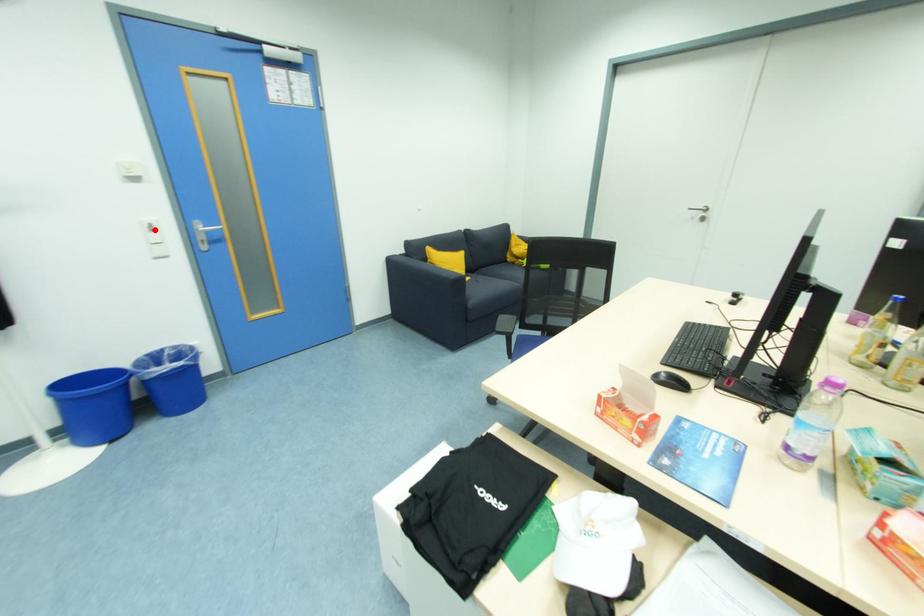
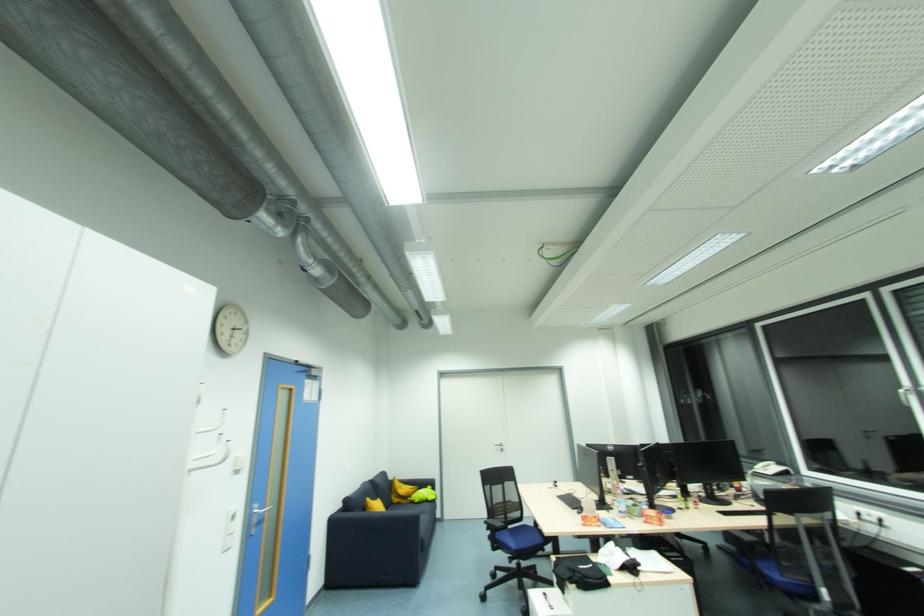
The point at the highlighted location is marked in the first image. Where is the corresponding point in the second image?

(236, 520)